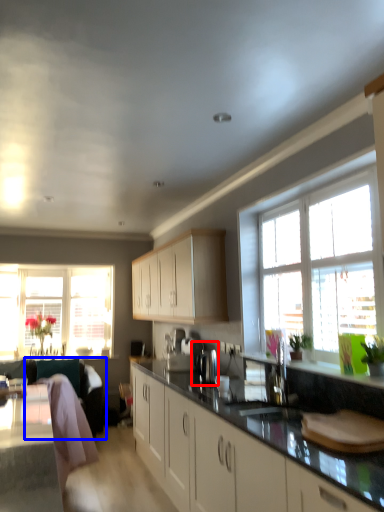
Question: Which point is closer to the camera, coffee machine (highlighted by a red box) or swivel chair (highlighted by a blue box)?

Choices:
 (A) coffee machine
 (B) swivel chair

Answer: (A)